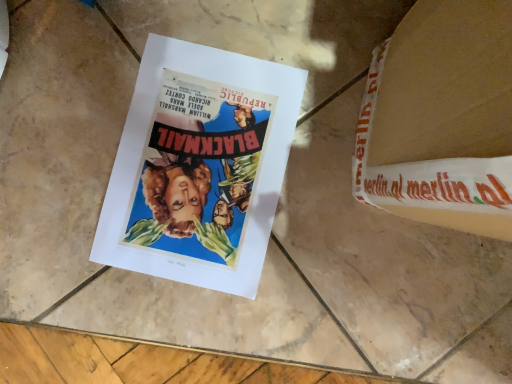
Question: Does white cardboard at upper right appear on the left side of matte paper poster at center?

Choices:
 (A) no
 (B) yes

Answer: (A)

Question: Can you confirm if white cardboard at upper right is smaller than matte paper poster at center?

Choices:
 (A) yes
 (B) no

Answer: (B)

Question: Considering the relative positions of white cardboard at upper right and matte paper poster at center in the image provided, is white cardboard at upper right to the right of matte paper poster at center from the viewer's perspective?

Choices:
 (A) yes
 (B) no

Answer: (A)

Question: From a real-world perspective, does white cardboard at upper right stand above matte paper poster at center?

Choices:
 (A) yes
 (B) no

Answer: (A)

Question: Does white cardboard at upper right lie behind matte paper poster at center?

Choices:
 (A) no
 (B) yes

Answer: (A)

Question: Considering the relative sizes of white cardboard at upper right and matte paper poster at center in the image provided, is white cardboard at upper right thinner than matte paper poster at center?

Choices:
 (A) no
 (B) yes

Answer: (A)

Question: Can you confirm if matte paper poster at center is wider than white cardboard at upper right?

Choices:
 (A) no
 (B) yes

Answer: (A)

Question: Does matte paper poster at center appear on the right side of white cardboard at upper right?

Choices:
 (A) yes
 (B) no

Answer: (B)

Question: Does matte paper poster at center have a lesser width compared to white cardboard at upper right?

Choices:
 (A) yes
 (B) no

Answer: (A)

Question: Is white cardboard at upper right at the back of matte paper poster at center?

Choices:
 (A) no
 (B) yes

Answer: (A)

Question: From the image's perspective, is matte paper poster at center on top of white cardboard at upper right?

Choices:
 (A) yes
 (B) no

Answer: (B)

Question: Can you confirm if matte paper poster at center is bigger than white cardboard at upper right?

Choices:
 (A) yes
 (B) no

Answer: (B)

Question: Is matte paper poster at center inside or outside of white cardboard at upper right?

Choices:
 (A) outside
 (B) inside

Answer: (A)